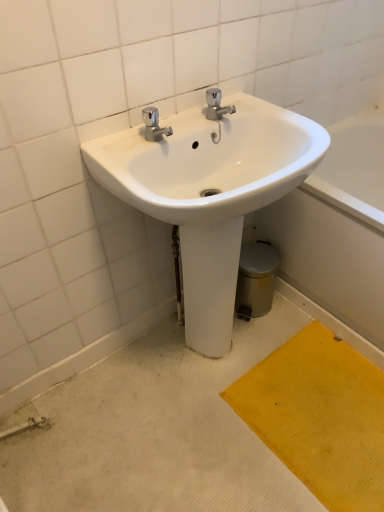
Locate an element on the screen. The width and height of the screenshot is (384, 512). free spot above yellow textured mat at lower right (from a real-world perspective) is located at coordinates (322, 410).